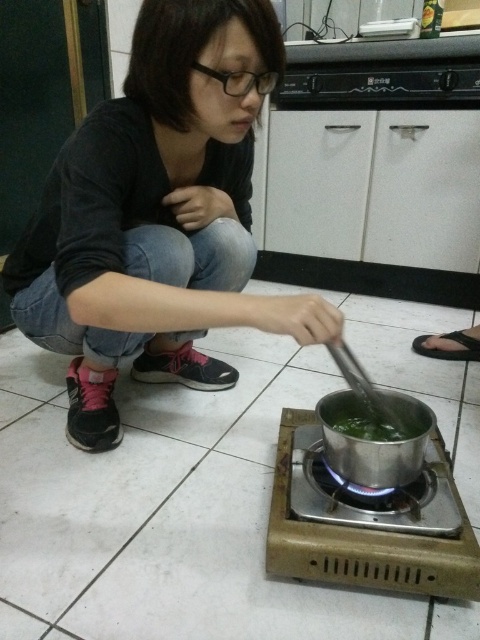
You are a chef in a small kitchen and need to place two identical gas stoves. The first stove is the silver metallic gas stove at center, and the second is the silver metallic gas stove at lower center. According to the image, how are these two stoves arranged spatially?

The silver metallic gas stove at center is positioned on the left side of the silver metallic gas stove at lower center, meaning they are arranged horizontally with the first stove to the left of the second one.

You are standing in the kitchen and see two points marked on the floor. The first point is at position point (373, 577) and the second is at point (320, 506). If you want to move from the first point to the second point, which direction should you move?

To move from point (373, 577) to point (320, 506), you should move backward since point (373, 577) is in front of point (320, 506).